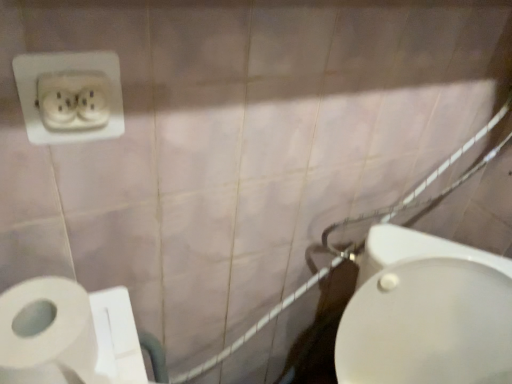
Question: From the image's perspective, is white plastic power plugs and sockets at upper left located beneath white matte toilet paper at lower left?

Choices:
 (A) no
 (B) yes

Answer: (A)

Question: From a real-world perspective, is white plastic power plugs and sockets at upper left positioned under white matte toilet paper at lower left based on gravity?

Choices:
 (A) yes
 (B) no

Answer: (B)

Question: Does white plastic power plugs and sockets at upper left have a lesser height compared to white matte toilet paper at lower left?

Choices:
 (A) yes
 (B) no

Answer: (B)

Question: From the image's perspective, does white plastic power plugs and sockets at upper left appear higher than white matte toilet paper at lower left?

Choices:
 (A) no
 (B) yes

Answer: (B)

Question: Is white matte toilet paper at lower left inside white plastic power plugs and sockets at upper left?

Choices:
 (A) no
 (B) yes

Answer: (A)

Question: Can you confirm if white plastic power plugs and sockets at upper left is wider than white matte toilet paper at lower left?

Choices:
 (A) no
 (B) yes

Answer: (A)

Question: Does white glossy bidet at lower right turn towards white matte toilet paper at lower left?

Choices:
 (A) yes
 (B) no

Answer: (B)

Question: Is white glossy bidet at lower right touching white matte toilet paper at lower left?

Choices:
 (A) no
 (B) yes

Answer: (A)

Question: From a real-world perspective, is white glossy bidet at lower right positioned under white matte toilet paper at lower left based on gravity?

Choices:
 (A) yes
 (B) no

Answer: (A)

Question: Does white glossy bidet at lower right have a smaller size compared to white matte toilet paper at lower left?

Choices:
 (A) no
 (B) yes

Answer: (A)

Question: Does white glossy bidet at lower right appear on the left side of white matte toilet paper at lower left?

Choices:
 (A) no
 (B) yes

Answer: (A)

Question: Considering the relative positions of white glossy bidet at lower right and white matte toilet paper at lower left in the image provided, is white glossy bidet at lower right to the right of white matte toilet paper at lower left from the viewer's perspective?

Choices:
 (A) no
 (B) yes

Answer: (B)

Question: Is white glossy bidet at lower right thinner than white ceramic shower at right?

Choices:
 (A) yes
 (B) no

Answer: (B)